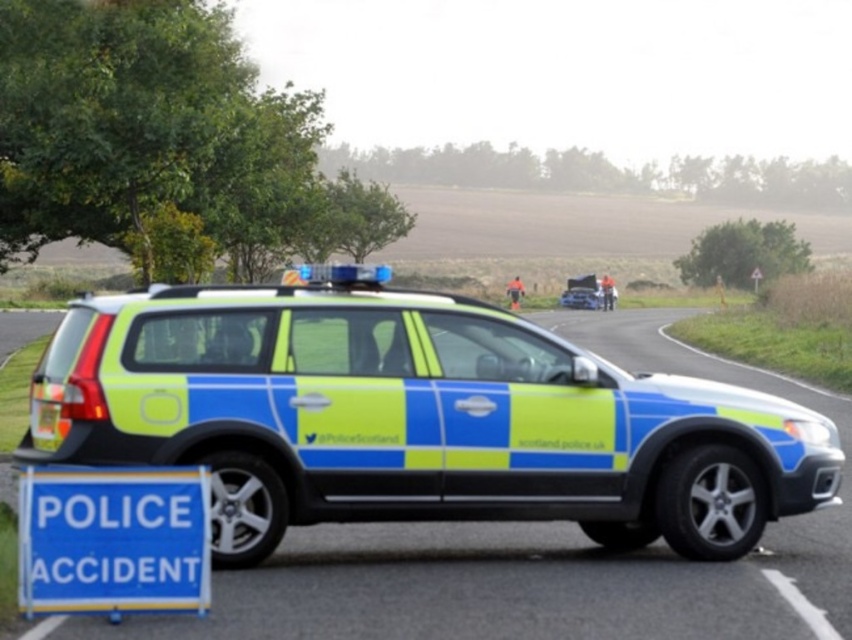
You are a driver approaching the scene and see both the matte metallic police car at center and the neon green plastic police car at center. Which one is shorter in height?

The matte metallic police car at center is not as tall as the neon green plastic police car at center, so the matte metallic police car at center is shorter in height.